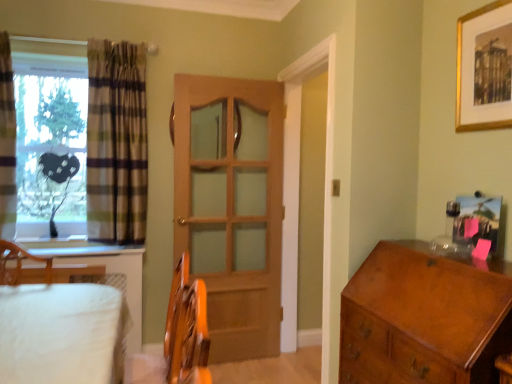
Question: Considering the positions of plaid fabric curtain at left, the 1th curtain when ordered from left to right, and metallic gold picture frame at upper right, which ranks as the first picture frame in bottom-to-top order, in the image, is plaid fabric curtain at left, the 1th curtain when ordered from left to right, bigger or smaller than metallic gold picture frame at upper right, which ranks as the first picture frame in bottom-to-top order,?

Choices:
 (A) small
 (B) big

Answer: (B)

Question: Is plaid fabric curtain at left, positioned as the second curtain in right-to-left order, wider or thinner than metallic gold picture frame at upper right, which ranks as the first picture frame in bottom-to-top order?

Choices:
 (A) thin
 (B) wide

Answer: (B)

Question: Considering the real-world distances, which object is closest to the gold metallic picture frame at upper right, positioned as the first picture frame in top-to-bottom order?

Choices:
 (A) transparent plastic heart at left
 (B) plaid fabric curtain at left, the 1th curtain when ordered from left to right
 (C) shiny brown wooden chest of drawers at right
 (D) wooden door at center
 (E) metallic gold picture frame at upper right, arranged as the second picture frame when viewed from the top

Answer: (E)

Question: Based on their relative distances, which object is nearer to the wooden door at center?

Choices:
 (A) shiny brown wooden chest of drawers at right
 (B) metallic gold picture frame at upper right, which ranks as the first picture frame in bottom-to-top order
 (C) plaid fabric curtain at left, positioned as the second curtain in right-to-left order
 (D) gold metallic picture frame at upper right, positioned as the first picture frame in top-to-bottom order
 (E) transparent plastic heart at left

Answer: (E)